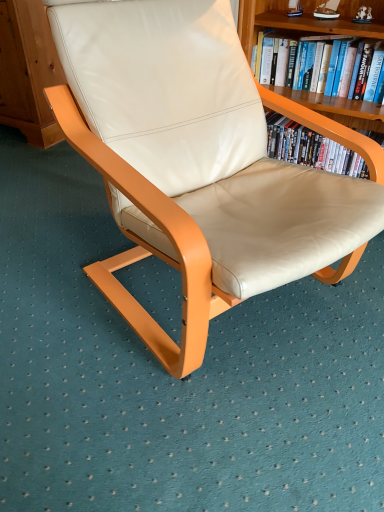
Locate an element on the screen. vacant region to the left of beige leather chair at center is located at coordinates (54, 266).